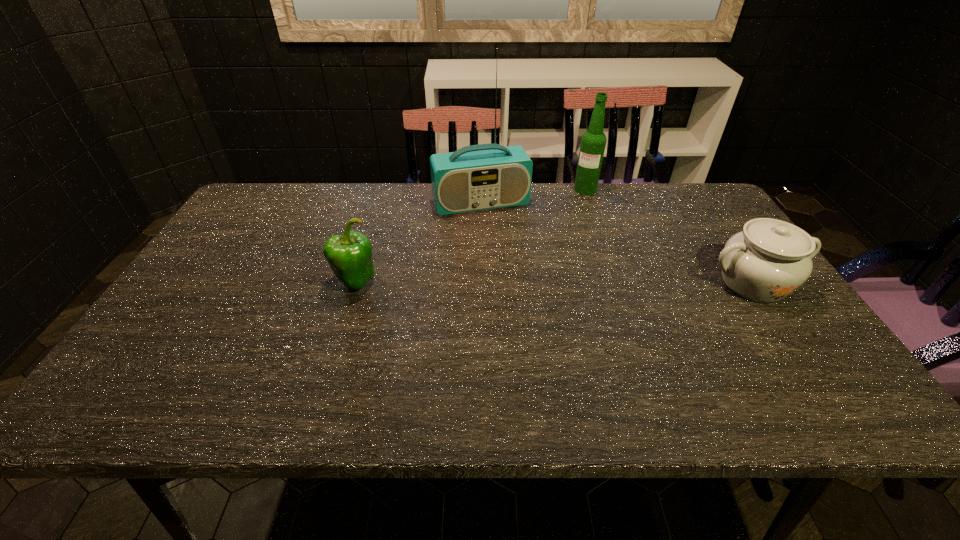
Where is `free space on the desktop that is between the bell pepper and the chinaware and is positioned on the front panel of the third object from right to left`? Image resolution: width=960 pixels, height=540 pixels. free space on the desktop that is between the bell pepper and the chinaware and is positioned on the front panel of the third object from right to left is located at coordinates (515, 283).

The width and height of the screenshot is (960, 540). I want to click on vacant spot on the desktop that is between the leftmost object and the chinaware and is positioned on the label of the third shortest object, so click(x=557, y=283).